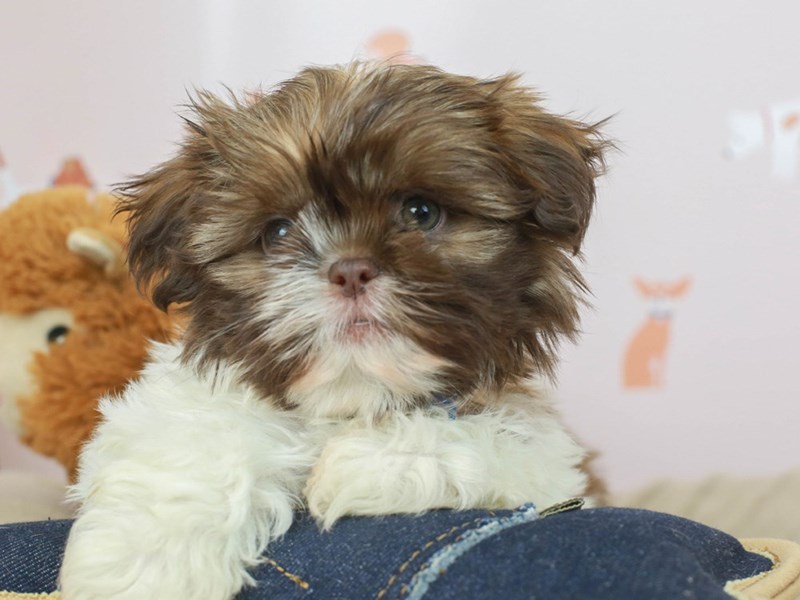
The height and width of the screenshot is (600, 800). I want to click on stuffed animal, so click(114, 316).